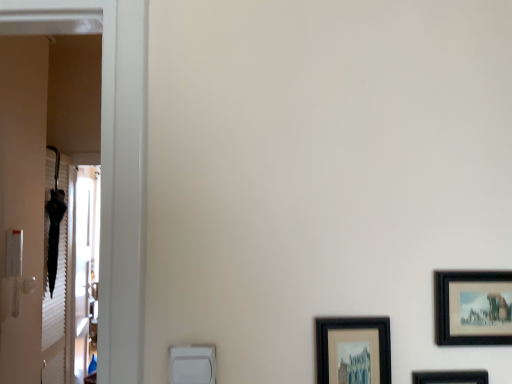
Question: Which is correct: black matte picture frame at right, which is the 1th picture frame in right-to-left order, is inside clear glass screen door at left, or outside of it?

Choices:
 (A) outside
 (B) inside

Answer: (A)

Question: Based on their positions, is black matte picture frame at right, which is the 1th picture frame in right-to-left order, located to the left or right of clear glass screen door at left?

Choices:
 (A) left
 (B) right

Answer: (B)

Question: Which of these objects is positioned closest to the black matte picture frame at right, which is the 1th picture frame in right-to-left order?

Choices:
 (A) black matte picture frame at lower right, which is the 1th picture frame from left to right
 (B) clear glass screen door at left
 (C) black matte picture frame at lower right, arranged as the 2th picture frame when viewed from the right

Answer: (C)

Question: Which of these objects is positioned farthest from the black matte picture frame at lower right, which is the second picture frame from left to right?

Choices:
 (A) black matte picture frame at lower right, the 3th picture frame viewed from the right
 (B) black matte picture frame at right, arranged as the third picture frame when viewed from the left
 (C) clear glass screen door at left

Answer: (C)